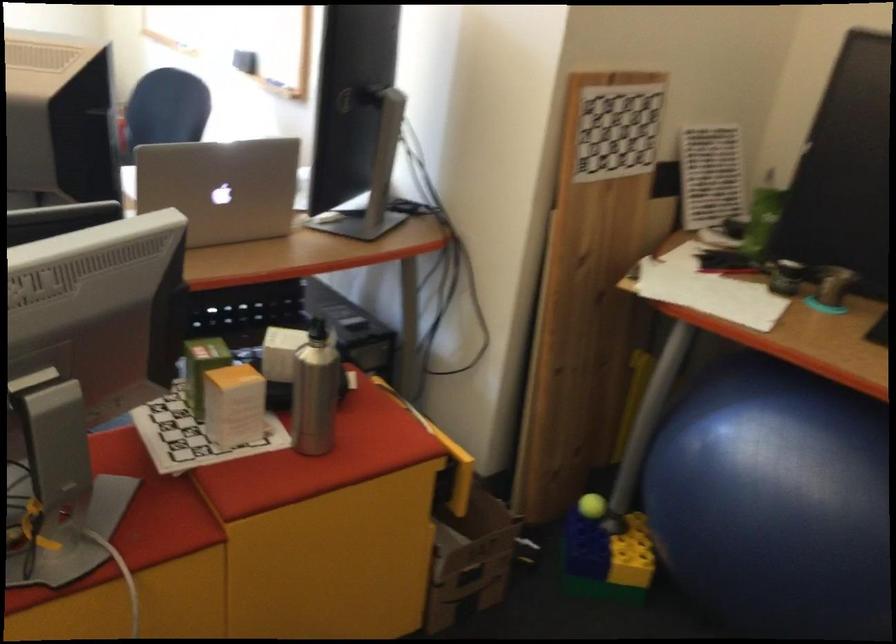
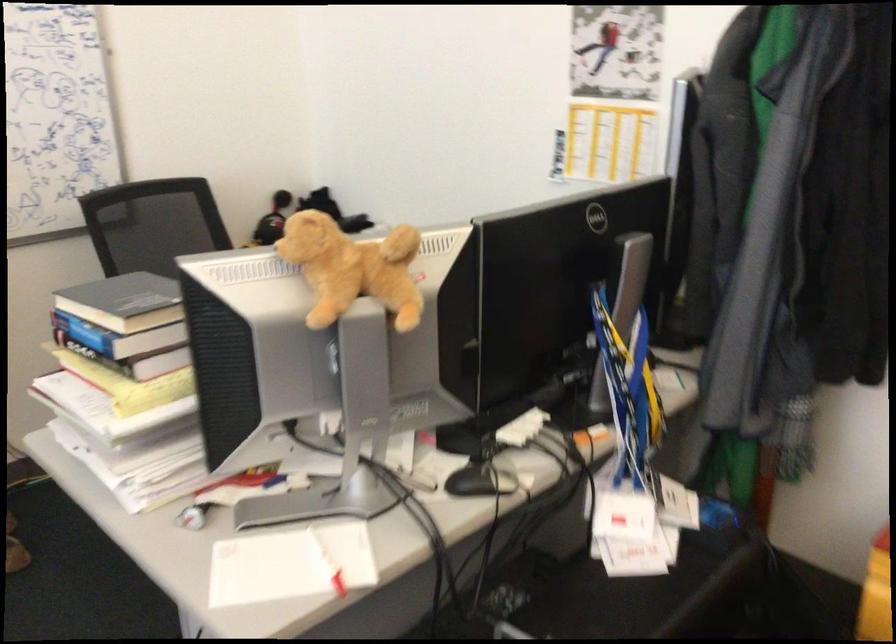
How did the camera likely rotate?

The rotation direction of the camera is right-down.